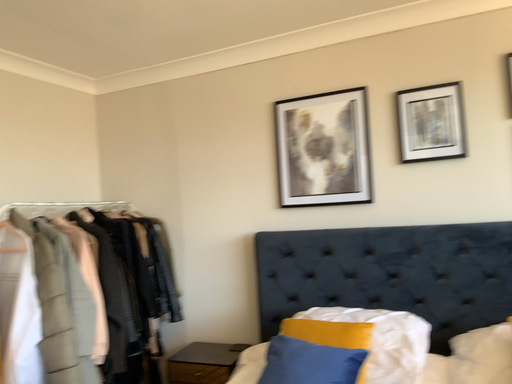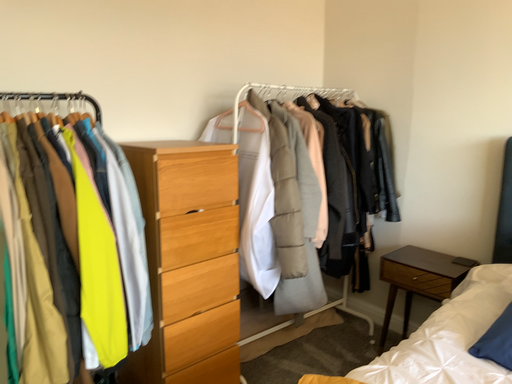
Question: Which way did the camera rotate in the video?

Choices:
 (A) rotated right
 (B) rotated left

Answer: (B)